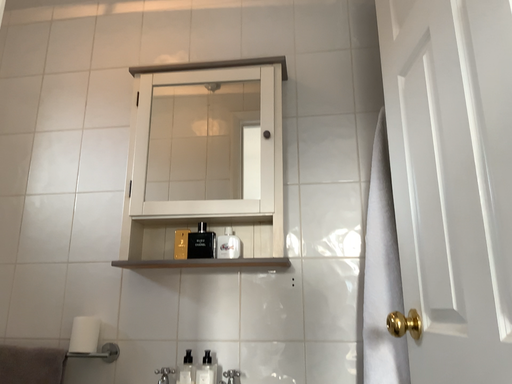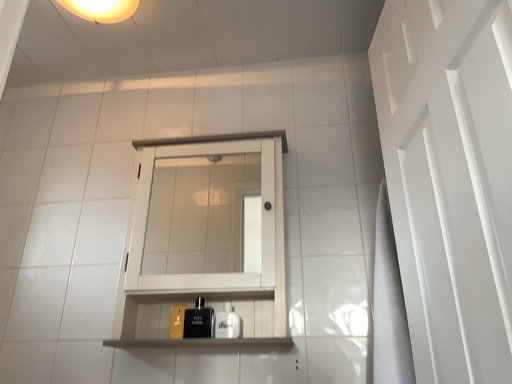
Question: Which way did the camera rotate in the video?

Choices:
 (A) rotated downward
 (B) rotated upward

Answer: (B)